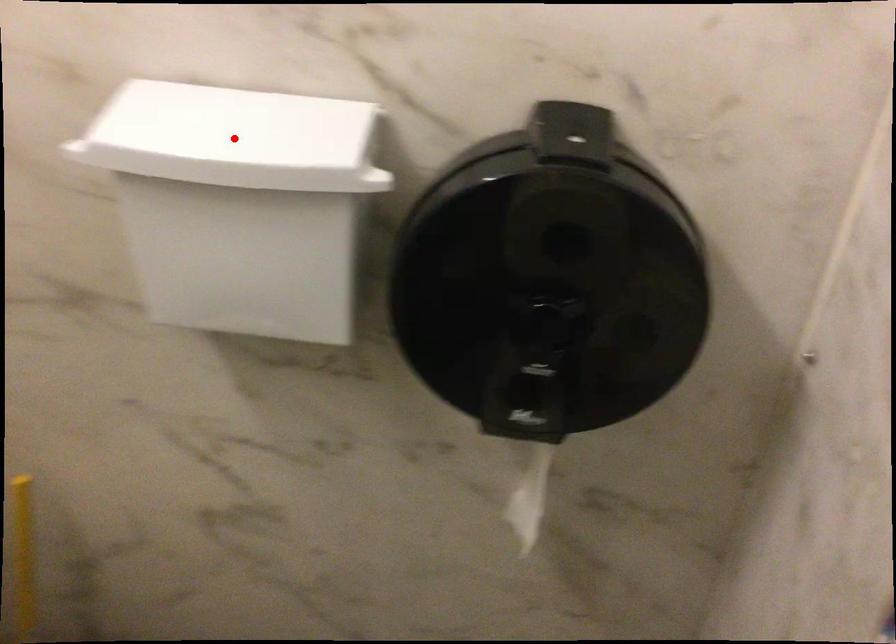
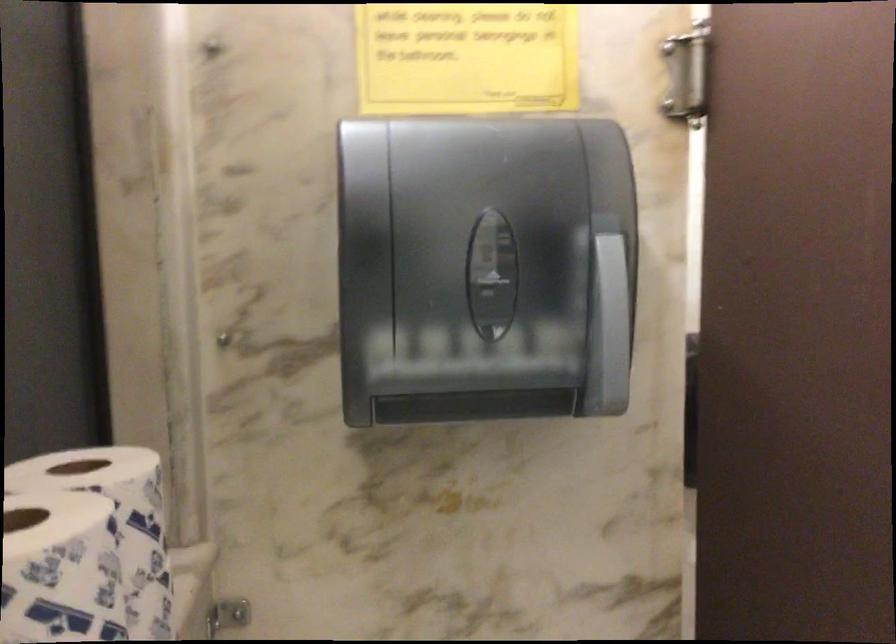
Question: I am providing you with two images of the same scene from different viewpoints. A red point is marked on the first image. Can you still see the location of the red point in image 2?

Choices:
 (A) Yes
 (B) No

Answer: (B)